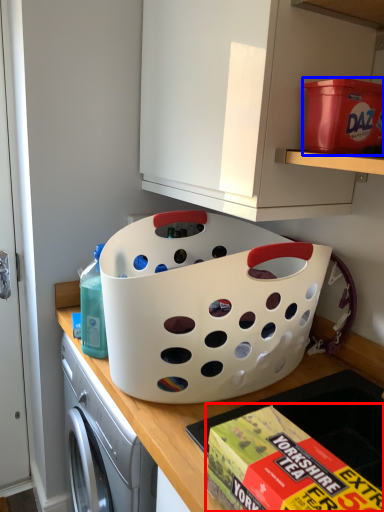
Question: Which point is closer to the camera, box (highlighted by a red box) or storage box (highlighted by a blue box)?

Choices:
 (A) box
 (B) storage box

Answer: (A)